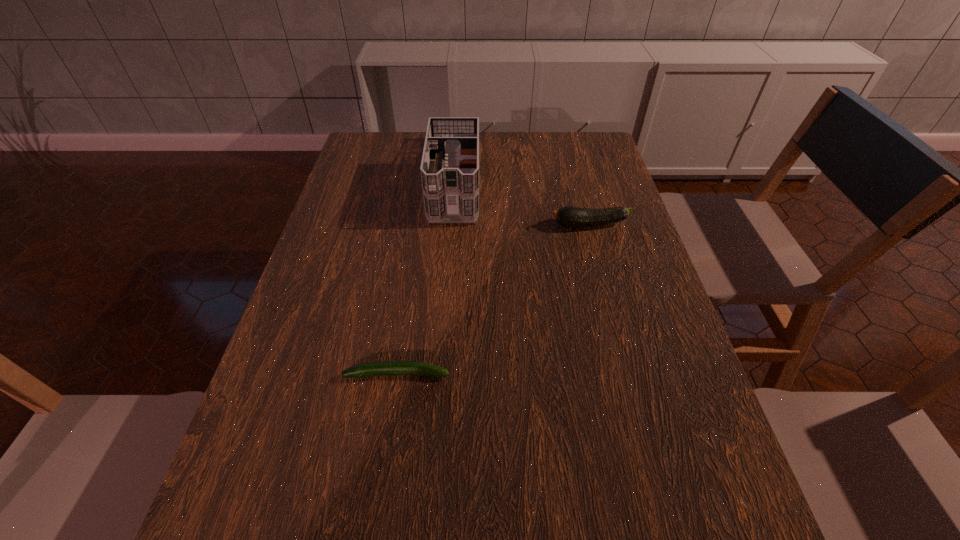
Where is `free space between the rightmost object and the dollhouse`? Image resolution: width=960 pixels, height=540 pixels. free space between the rightmost object and the dollhouse is located at coordinates (522, 201).

You are a GUI agent. You are given a task and a screenshot of the screen. Output one action in this format:
    pyautogui.click(x=<x>, y=<y>)
    Task: Click on the vacant region between the shortest object and the rightmost object
    
    Given the screenshot: What is the action you would take?
    pyautogui.click(x=493, y=300)

Locate an element on the screen. This screenshot has width=960, height=540. blank region between the tallest object and the shortest object is located at coordinates (426, 276).

This screenshot has width=960, height=540. In order to click on free spot between the tallest object and the rightmost object in this screenshot , I will do `click(522, 201)`.

Where is `empty location between the rightmost object and the dollhouse`? This screenshot has height=540, width=960. empty location between the rightmost object and the dollhouse is located at coordinates (522, 201).

I want to click on vacant area that lies between the dollhouse and the right zucchini, so click(522, 201).

This screenshot has height=540, width=960. Identify the location of unoccupied area between the second shortest object and the left zucchini. (493, 300).

Identify the location of free space between the tallest object and the second tallest object. Image resolution: width=960 pixels, height=540 pixels. (522, 201).

At what (x,y) coordinates should I click in order to perform the action: click on object that is the closest to the right zucchini. Please return your answer as a coordinate pair (x, y). Image resolution: width=960 pixels, height=540 pixels. Looking at the image, I should click on (449, 168).

Locate an element on the screen. The width and height of the screenshot is (960, 540). the closest object relative to the right zucchini is located at coordinates (449, 168).